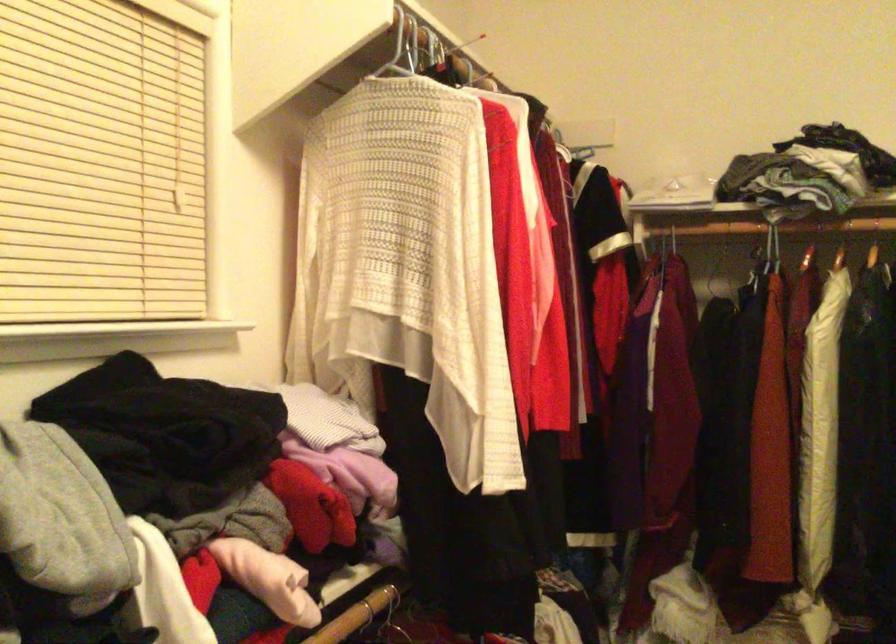
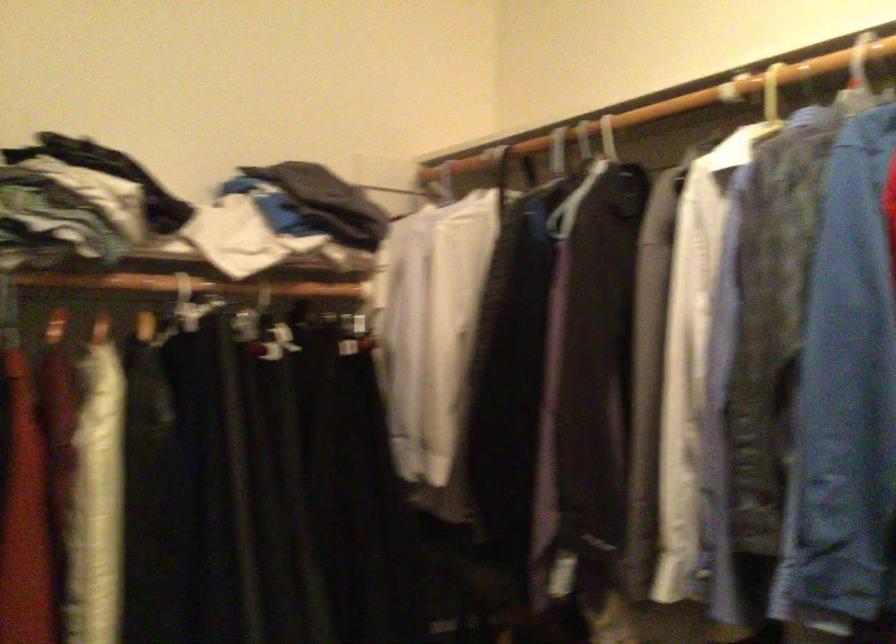
Question: How did the camera likely rotate?

Choices:
 (A) Left
 (B) Right
 (C) Up
 (D) Down

Answer: (B)